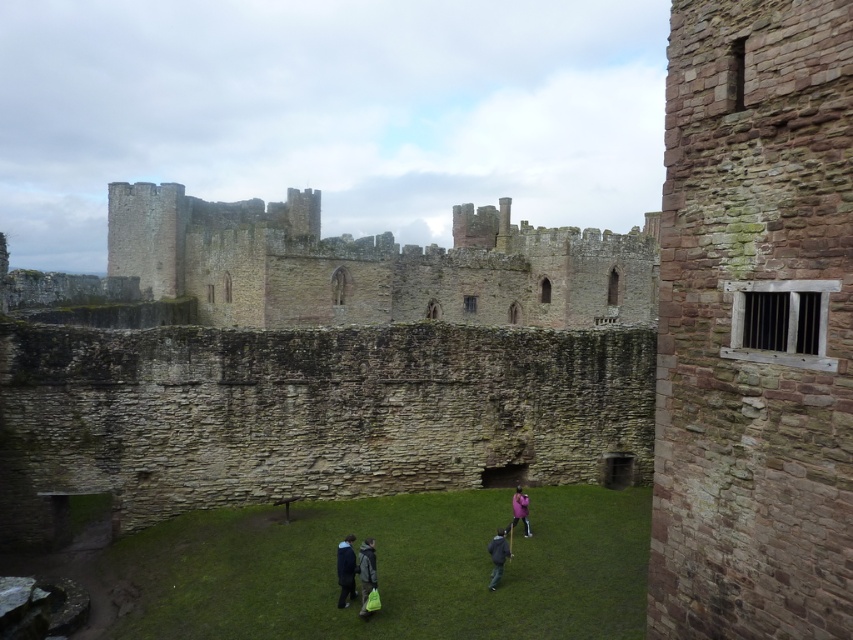
Can you confirm if dark gray jacket at center is taller than pink fabric at center?

Incorrect, dark gray jacket at center's height is not larger of pink fabric at center's.

Can you confirm if dark gray jacket at center is bigger than pink fabric at center?

Incorrect, dark gray jacket at center is not larger than pink fabric at center.

Between point (490, 589) and point (515, 515), which one is positioned in front?

Point (490, 589) is in front.

Locate an element on the screen. dark gray jacket at center is located at coordinates (497, 556).

Does brown stone castle at center appear on the left side of green fabric bag at center?

Incorrect, brown stone castle at center is not on the left side of green fabric bag at center.

Can you confirm if brown stone castle at center is positioned below green fabric bag at center?

No, brown stone castle at center is not below green fabric bag at center.

Which is in front, point (548, 304) or point (372, 544)?

Point (372, 544)

You are a GUI agent. You are given a task and a screenshot of the screen. Output one action in this format:
    pyautogui.click(x=<x>, y=<y>)
    Task: Click on the brown stone castle at center
    The image size is (853, 640).
    Given the screenshot: What is the action you would take?
    374,264

Which is behind, point (349, 538) or point (512, 504)?

The point (512, 504) is behind.

Does dark blue fabric jacket at lower center lie behind pink fabric at center?

That is False.

Which is in front, point (339, 573) or point (520, 508)?

Point (339, 573)

Identify the location of dark blue fabric jacket at lower center. (345, 570).